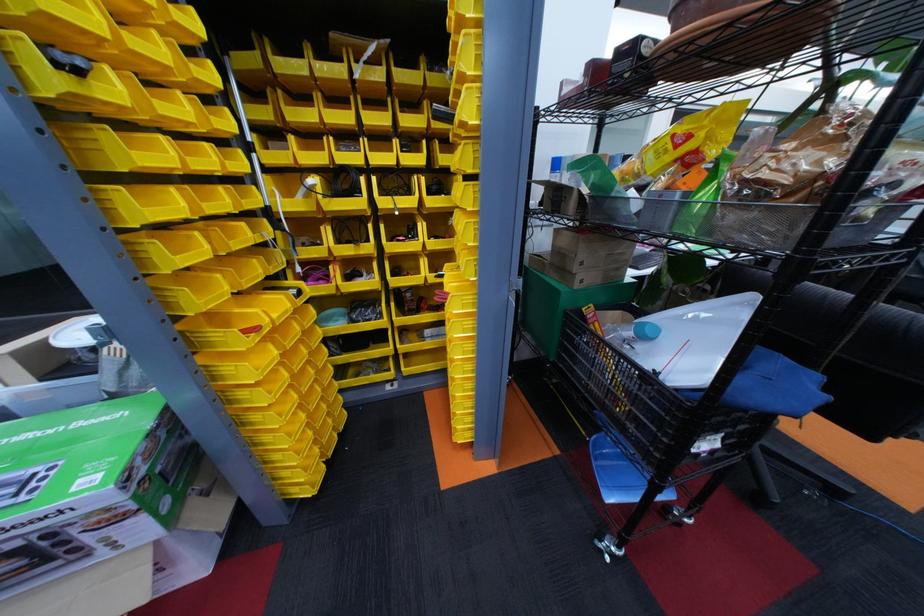
The image size is (924, 616). What are the coordinates of `cardboard box` in the screenshot? It's located at (590, 256).